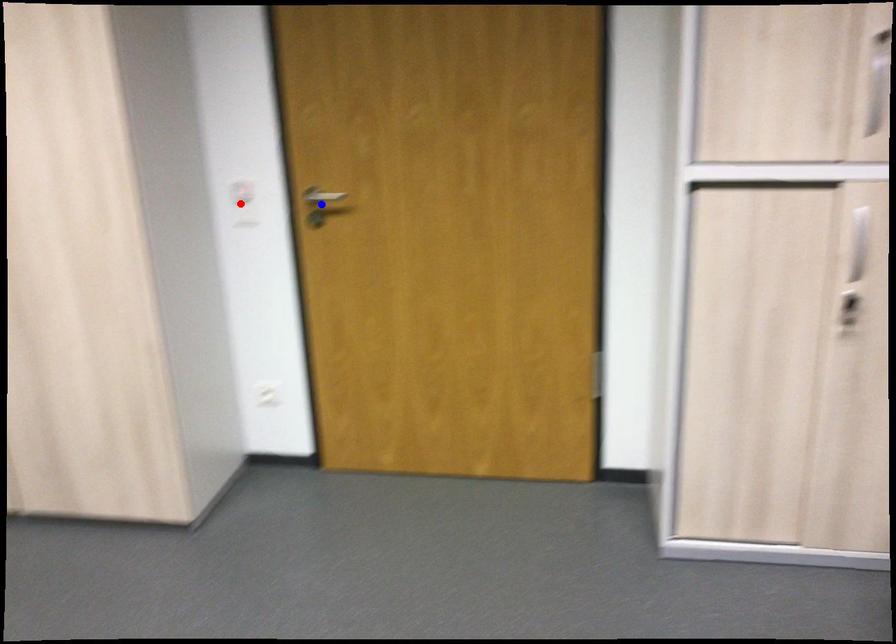
Question: In the image, two points are highlighted. Which point is nearer to the camera? Reply with the corresponding letter.

Choices:
 (A) blue point
 (B) red point

Answer: (A)